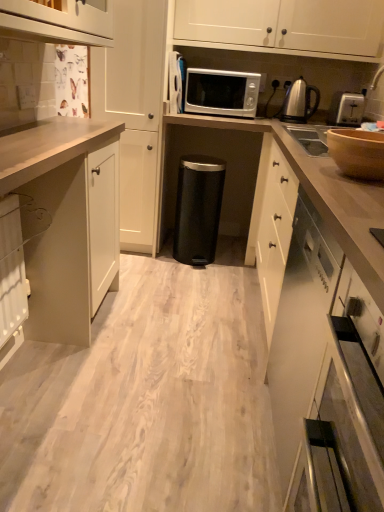
The image size is (384, 512). I want to click on white matte cabinet at upper center, acting as the 1th cabinetry starting from the back, so click(x=283, y=26).

Image resolution: width=384 pixels, height=512 pixels. In order to click on wooden bowl at upper right in this screenshot , I will do `click(357, 152)`.

Consider the image. What is the approximate height of wooden bowl at upper right?

wooden bowl at upper right is 5.04 inches tall.

This screenshot has width=384, height=512. What do you see at coordinates (310, 138) in the screenshot?
I see `wooden bowl at upper right` at bounding box center [310, 138].

What is the approximate height of polished stainless steel kettle at upper right?

The height of polished stainless steel kettle at upper right is 10.84 inches.

What is the approximate height of matte white cabinet at left, which is the second cabinetry in front-to-back order?

matte white cabinet at left, which is the second cabinetry in front-to-back order, is 35.96 inches in height.

Locate an element on the screen. silver metallic microwave at center is located at coordinates (221, 93).

You are a GUI agent. You are given a task and a screenshot of the screen. Output one action in this format:
    pyautogui.click(x=<x>, y=<y>)
    Task: Click on the white matte cabinet at upper center, which is the 4th cabinetry from front to back
    
    Given the screenshot: What is the action you would take?
    pyautogui.click(x=283, y=26)

Is wooden bowl at upper right wider than polished stainless steel kettle at upper right?

Correct, the width of wooden bowl at upper right exceeds that of polished stainless steel kettle at upper right.

Is wooden bowl at upper right inside the boundaries of polished stainless steel kettle at upper right, or outside?

wooden bowl at upper right is not inside polished stainless steel kettle at upper right, it's outside.

From the image's perspective, is wooden bowl at upper right over polished stainless steel kettle at upper right?

No, from the image's perspective, wooden bowl at upper right is not on top of polished stainless steel kettle at upper right.

How distant is wooden bowl at upper right from polished stainless steel kettle at upper right?

wooden bowl at upper right is 4.47 feet away from polished stainless steel kettle at upper right.

Is silver metallic microwave at center looking in the opposite direction of wooden bowl at upper right?

No, silver metallic microwave at center is not facing the opposite direction of wooden bowl at upper right.

Measure the distance from silver metallic microwave at center to wooden bowl at upper right.

silver metallic microwave at center is 27.20 inches from wooden bowl at upper right.

Consider the image. From the image's perspective, is silver metallic microwave at center positioned above or below wooden bowl at upper right?

Based on their image positions, silver metallic microwave at center is located above wooden bowl at upper right.

Can you tell me how much silver metallic microwave at center and wooden bowl at upper right differ in facing direction?

The facing directions of silver metallic microwave at center and wooden bowl at upper right are 91.4 degrees apart.

From a real-world perspective, is white matte cabinet at upper center, acting as the 1th cabinetry starting from the back, on wooden bowl at upper right?

Yes, from a real-world perspective, white matte cabinet at upper center, acting as the 1th cabinetry starting from the back, is above wooden bowl at upper right.

From the image's perspective, which one is positioned higher, white matte cabinet at upper center, acting as the 1th cabinetry starting from the back, or wooden bowl at upper right?

white matte cabinet at upper center, acting as the 1th cabinetry starting from the back.

Between white matte cabinet at upper center, which is the 4th cabinetry from front to back, and wooden bowl at upper right, which one has smaller size?

With smaller size is wooden bowl at upper right.

Would you say white matte cabinet at upper center, which is the 4th cabinetry from front to back, is inside or outside wooden bowl at upper right?

white matte cabinet at upper center, which is the 4th cabinetry from front to back, is outside wooden bowl at upper right.

Between white matte cabinet at center, the third cabinetry in the front-to-back sequence, and wooden bowl at upper right, which one appears on the right side from the viewer's perspective?

Positioned to the right is wooden bowl at upper right.

Is white matte cabinet at center, arranged as the 2th cabinetry when viewed from the back, shorter than wooden bowl at upper right?

Incorrect, the height of white matte cabinet at center, arranged as the 2th cabinetry when viewed from the back, does not fall short of that of wooden bowl at upper right.

Can you tell me how much white matte cabinet at center, arranged as the 2th cabinetry when viewed from the back, and wooden bowl at upper right differ in facing direction?

white matte cabinet at center, arranged as the 2th cabinetry when viewed from the back, and wooden bowl at upper right are facing 90.4 degrees away from each other.

Which point is more distant from viewer, (143,179) or (333,133)?

The point (143,179) is behind.

From the picture: Is white matte cabinet at center, arranged as the 2th cabinetry when viewed from the back, situated inside white matte cabinet at upper center, acting as the 1th cabinetry starting from the back, or outside?

white matte cabinet at center, arranged as the 2th cabinetry when viewed from the back, is not inside white matte cabinet at upper center, acting as the 1th cabinetry starting from the back, it's outside.

Based on the photo, is white matte cabinet at center, the third cabinetry in the front-to-back sequence, looking in the opposite direction of white matte cabinet at upper center, which is the 4th cabinetry from front to back?

That's not correct — white matte cabinet at center, the third cabinetry in the front-to-back sequence, is not looking away from white matte cabinet at upper center, which is the 4th cabinetry from front to back.

Based on the photo, how much distance is there between white matte cabinet at center, arranged as the 2th cabinetry when viewed from the back, and white matte cabinet at upper center, acting as the 1th cabinetry starting from the back?

They are 25.78 inches apart.

Does white matte cabinet at center, the third cabinetry in the front-to-back sequence, touch white matte cabinet at upper center, which is the 4th cabinetry from front to back?

No, white matte cabinet at center, the third cabinetry in the front-to-back sequence, is not in contact with white matte cabinet at upper center, which is the 4th cabinetry from front to back.

Would you say wooden bowl at upper right is a long distance from black matte trash can at center?

wooden bowl at upper right is near black matte trash can at center, not far away.

How many degrees apart are the facing directions of wooden bowl at upper right and black matte trash can at center?

wooden bowl at upper right and black matte trash can at center are facing 91.6 degrees away from each other.

Can you confirm if wooden bowl at upper right is taller than black matte trash can at center?

No, wooden bowl at upper right is not taller than black matte trash can at center.

Is wooden bowl at upper right completely or partially outside of black matte trash can at center?

wooden bowl at upper right is positioned outside black matte trash can at center.

Between wooden bowl at upper right and white matte cabinet at upper center, acting as the 1th cabinetry starting from the back, which one has smaller size?

Smaller between the two is wooden bowl at upper right.

Is the surface of wooden bowl at upper right in direct contact with white matte cabinet at upper center, which is the 4th cabinetry from front to back?

They are not placed beside each other.

Considering the positions of objects wooden bowl at upper right and white matte cabinet at upper center, which is the 4th cabinetry from front to back, in the image provided, who is in front, wooden bowl at upper right or white matte cabinet at upper center, which is the 4th cabinetry from front to back,?

Positioned in front is wooden bowl at upper right.

In the scene shown: Is wooden bowl at upper right taller or shorter than white matte cabinet at upper center, which is the 4th cabinetry from front to back?

Considering their sizes, wooden bowl at upper right has less height than white matte cabinet at upper center, which is the 4th cabinetry from front to back.

Find the location of a particular element. This screenshot has width=384, height=512. home appliance located on the left of polished stainless steel kettle at upper right is located at coordinates (357, 152).

Image resolution: width=384 pixels, height=512 pixels. What are the coordinates of `sink in front of the silver metallic microwave at center` in the screenshot? It's located at (310, 138).

From the image, which object appears to be nearer to polished stainless steel kettle at upper right, wooden bowl at upper right or white matte cabinet at lower right, which appears as the first cabinetry when viewed from the front?

Among the two, wooden bowl at upper right is located nearer to polished stainless steel kettle at upper right.

From the image, which object appears to be nearer to white matte cabinet at upper center, acting as the 1th cabinetry starting from the back, wooden bowl at upper right or matte white cabinet at left, acting as the third cabinetry starting from the back?

wooden bowl at upper right.

Which object lies nearer to the anchor point wooden bowl at upper right, polished stainless steel kettle at upper right or wooden bowl at upper right?

wooden bowl at upper right is positioned closer to the anchor wooden bowl at upper right.

Estimate the real-world distances between objects in this image. Which object is further from wooden bowl at upper right, white matte cabinet at upper center, which is the 4th cabinetry from front to back, or white matte cabinet at center, the third cabinetry in the front-to-back sequence?

white matte cabinet at center, the third cabinetry in the front-to-back sequence, lies further to wooden bowl at upper right than the other object.

Considering their positions, is white matte cabinet at center, arranged as the 2th cabinetry when viewed from the back, positioned closer to wooden bowl at upper right than wooden bowl at upper right?

Based on the image, wooden bowl at upper right appears to be nearer to wooden bowl at upper right.

Based on their spatial positions, is white matte cabinet at center, arranged as the 2th cabinetry when viewed from the back, or matte white cabinet at left, which is the second cabinetry in front-to-back order, closer to black matte trash can at center?

matte white cabinet at left, which is the second cabinetry in front-to-back order, is positioned closer to the anchor black matte trash can at center.

Looking at the image, which one is located further to white matte cabinet at center, the third cabinetry in the front-to-back sequence, wooden bowl at upper right or white matte cabinet at lower right, acting as the fourth cabinetry starting from the back?

white matte cabinet at lower right, acting as the fourth cabinetry starting from the back, is positioned further to the anchor white matte cabinet at center, the third cabinetry in the front-to-back sequence.

Looking at the image, which one is located further to matte white cabinet at left, acting as the third cabinetry starting from the back, wooden bowl at upper right or black matte trash can at center?

Among the two, wooden bowl at upper right is located further to matte white cabinet at left, acting as the third cabinetry starting from the back.

Identify the location of home appliance positioned between matte white cabinet at left, acting as the third cabinetry starting from the back, and white matte cabinet at upper center, which is the 4th cabinetry from front to back, from near to far. The width and height of the screenshot is (384, 512). (357, 152).

Find the location of a particular element. Image resolution: width=384 pixels, height=512 pixels. sink positioned between white matte cabinet at lower right, acting as the fourth cabinetry starting from the back, and white matte cabinet at center, the third cabinetry in the front-to-back sequence, from near to far is located at coordinates (310, 138).

The width and height of the screenshot is (384, 512). What are the coordinates of `home appliance between matte white cabinet at left, acting as the third cabinetry starting from the back, and black matte trash can at center in the front-back direction` in the screenshot? It's located at 357,152.

The image size is (384, 512). What are the coordinates of `home appliance positioned between black matte trash can at center and black matte trash can at center from near to far` in the screenshot? It's located at (357, 152).